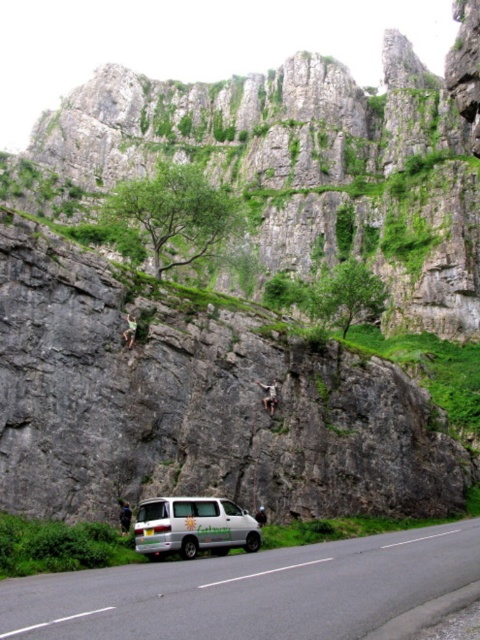
Question: Which point appears farthest from the camera in this image?

Choices:
 (A) (180, 529)
 (B) (253, 593)

Answer: (A)

Question: Does white asphalt road at lower center have a lesser width compared to white matte van at lower center?

Choices:
 (A) yes
 (B) no

Answer: (B)

Question: Is white asphalt road at lower center below white matte van at lower center?

Choices:
 (A) yes
 (B) no

Answer: (B)

Question: Which point appears farthest from the camera in this image?

Choices:
 (A) (108, 596)
 (B) (192, 512)

Answer: (B)

Question: Observing the image, what is the correct spatial positioning of white asphalt road at lower center in reference to white matte van at lower center?

Choices:
 (A) above
 (B) below

Answer: (A)